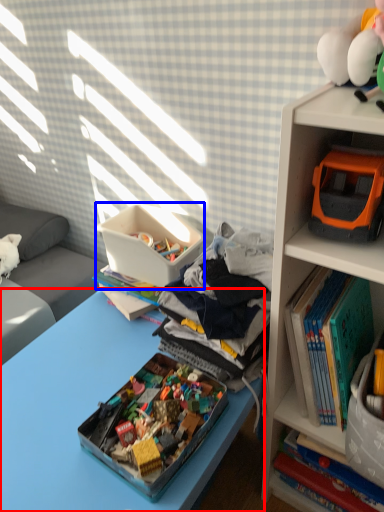
Question: Which object is closer to the camera taking this photo, desk (highlighted by a red box) or storage box (highlighted by a blue box)?

Choices:
 (A) desk
 (B) storage box

Answer: (A)